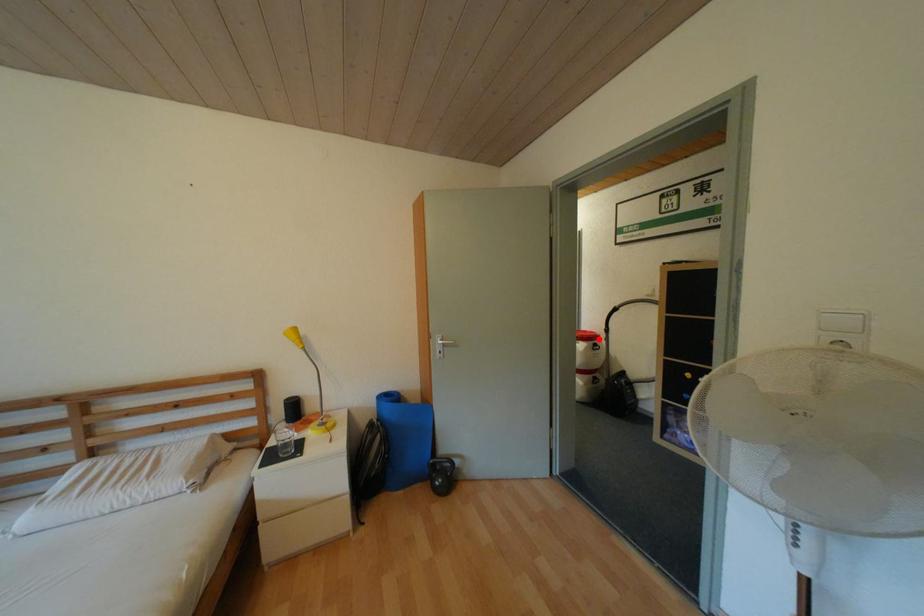
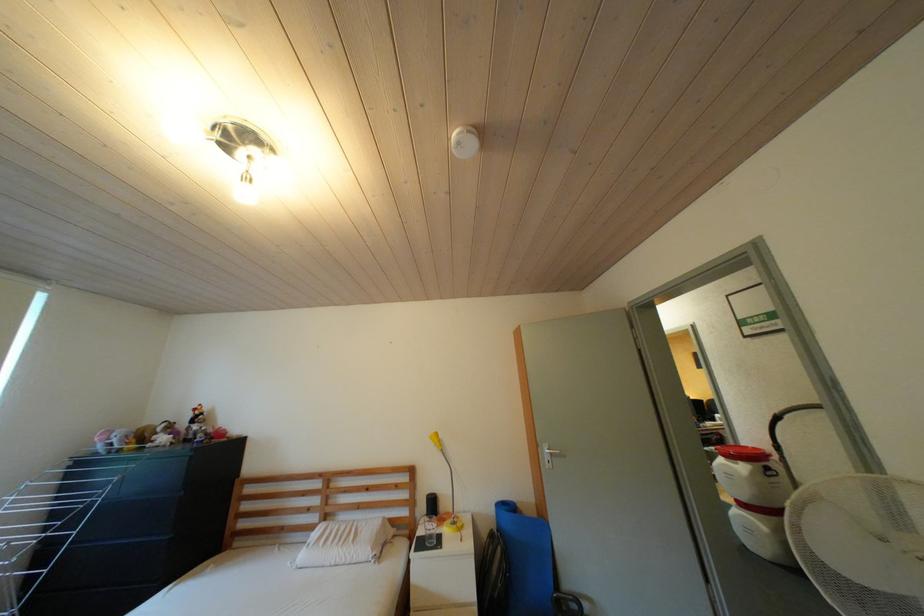
In the second image, find the point that corresponds to the highlighted location in the first image.

(763, 458)